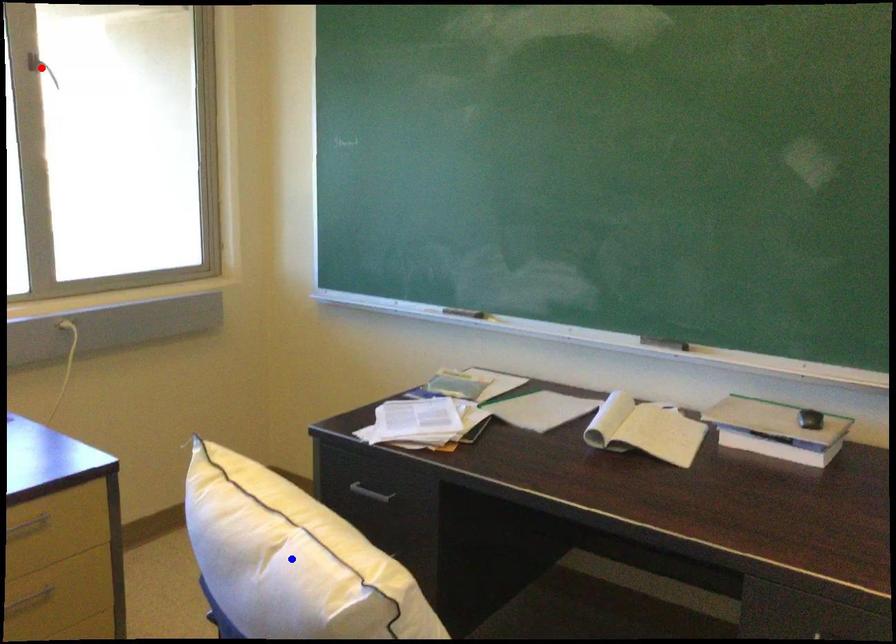
Question: Which of the two points in the image is closer to the camera?

Choices:
 (A) Blue point is closer.
 (B) Red point is closer.

Answer: (A)